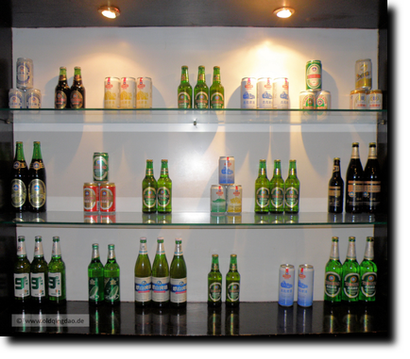
At what (x,y) coordinates should I click in order to perform the action: click on light. Please return your answer as a coordinate pair (x, y). This screenshot has width=410, height=359. Looking at the image, I should click on (104, 16), (284, 14).